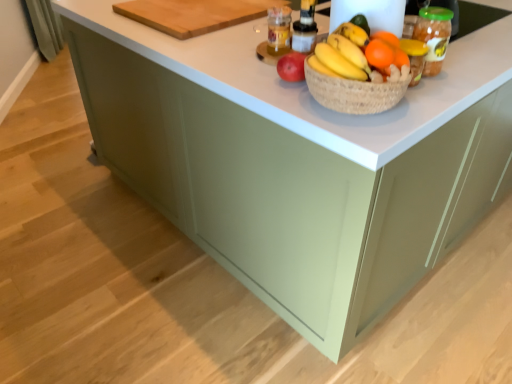
Question: Is wooden cutting board at upper center further to camera compared to orange matte at upper right?

Choices:
 (A) no
 (B) yes

Answer: (B)

Question: Does wooden cutting board at upper center appear on the left side of orange matte at upper right?

Choices:
 (A) no
 (B) yes

Answer: (B)

Question: Would you consider wooden cutting board at upper center to be distant from orange matte at upper right?

Choices:
 (A) no
 (B) yes

Answer: (A)

Question: Does wooden cutting board at upper center have a larger size compared to orange matte at upper right?

Choices:
 (A) yes
 (B) no

Answer: (A)

Question: From a real-world perspective, is wooden cutting board at upper center below orange matte at upper right?

Choices:
 (A) yes
 (B) no

Answer: (A)

Question: Is translucent plastic bottle at upper center bigger or smaller than orange matte grapefruit at center?

Choices:
 (A) big
 (B) small

Answer: (B)

Question: Looking at their shapes, would you say translucent plastic bottle at upper center is wider or thinner than orange matte grapefruit at center?

Choices:
 (A) thin
 (B) wide

Answer: (A)

Question: Considering their positions, is translucent plastic bottle at upper center located in front of or behind orange matte grapefruit at center?

Choices:
 (A) front
 (B) behind

Answer: (B)

Question: From the image's perspective, is translucent plastic bottle at upper center positioned above or below orange matte grapefruit at center?

Choices:
 (A) below
 (B) above

Answer: (B)

Question: Would you say orange matte grapefruit at center is to the left or to the right of translucent plastic bottle at upper center in the picture?

Choices:
 (A) left
 (B) right

Answer: (B)

Question: Choose the correct answer: Is orange matte grapefruit at center inside translucent plastic bottle at upper center or outside it?

Choices:
 (A) outside
 (B) inside

Answer: (A)

Question: From a real-world perspective, is orange matte grapefruit at center above or below translucent plastic bottle at upper center?

Choices:
 (A) below
 (B) above

Answer: (B)

Question: Is point (327, 52) positioned closer to the camera than point (285, 48)?

Choices:
 (A) closer
 (B) farther

Answer: (A)

Question: Considering the positions of orange matte at upper right and orange matte grapefruit at center in the image, is orange matte at upper right wider or thinner than orange matte grapefruit at center?

Choices:
 (A) wide
 (B) thin

Answer: (B)

Question: Considering the positions of orange matte at upper right and orange matte grapefruit at center in the image, is orange matte at upper right taller or shorter than orange matte grapefruit at center?

Choices:
 (A) tall
 (B) short

Answer: (B)